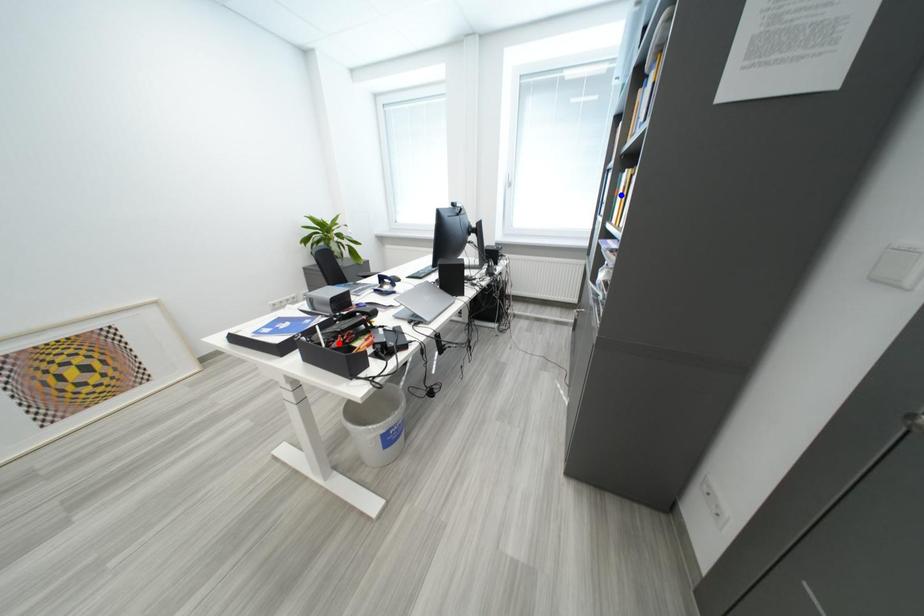
Question: In the image, two points are highlighted. Which point is nearer to the camera? Reply with the corresponding letter.

Choices:
 (A) blue point
 (B) red point

Answer: (B)